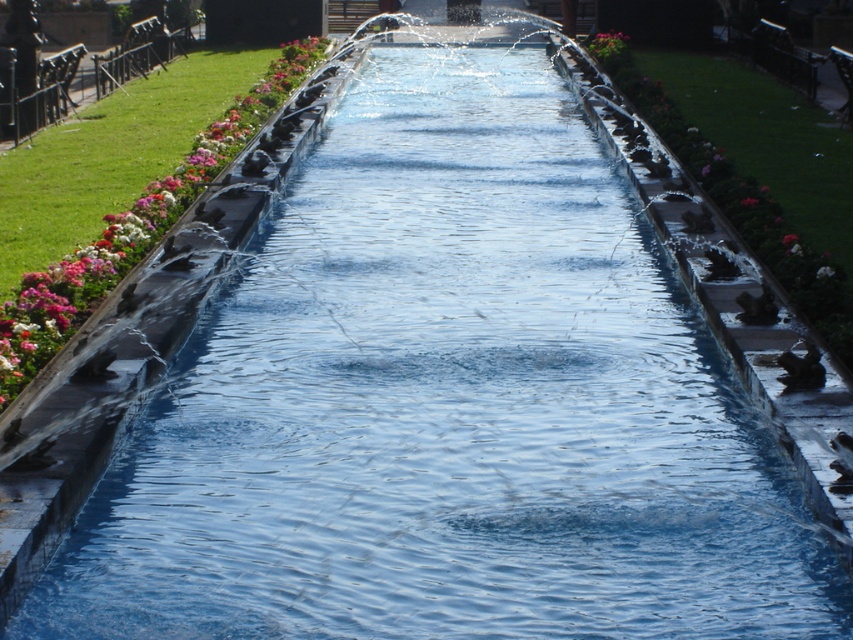
You are standing at the point marked by the coordinates point (x=131, y=230) in the image. What color flower are you closest to?

The point (x=131, y=230) indicates a pink glossy flower at left, so you are closest to the pink glossy flower at left.